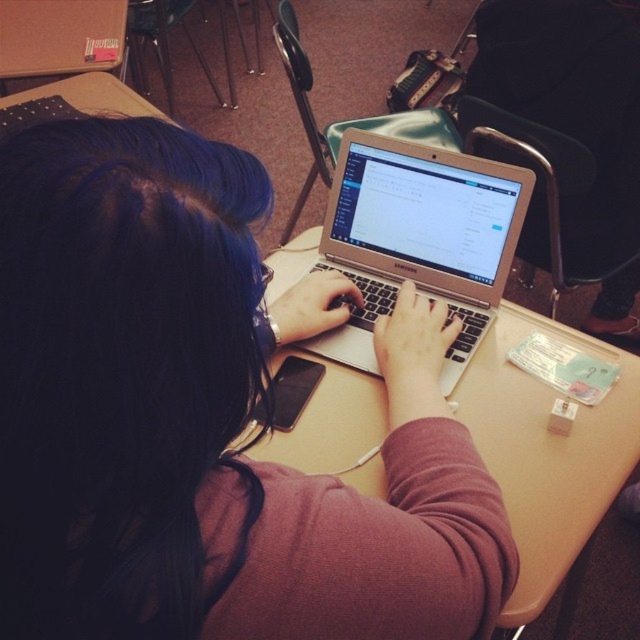
Question: Does beige wood table at center have a greater width compared to silver metallic laptop at center?

Choices:
 (A) yes
 (B) no

Answer: (A)

Question: Which of the following is the farthest from the observer?

Choices:
 (A) (486, 547)
 (B) (470, 321)
 (C) (323, 404)

Answer: (B)

Question: Which object is the farthest from the beige wood table at center?

Choices:
 (A) silver metallic laptop at center
 (B) matte silver laptop at center

Answer: (B)

Question: Is matte silver laptop at center to the left of silver metallic laptop at center from the viewer's perspective?

Choices:
 (A) no
 (B) yes

Answer: (B)

Question: Which of the following is the farthest from the observer?

Choices:
 (A) (536, 480)
 (B) (337, 262)
 (C) (333, 618)

Answer: (B)

Question: Can you confirm if matte silver laptop at center is wider than silver metallic laptop at center?

Choices:
 (A) no
 (B) yes

Answer: (A)